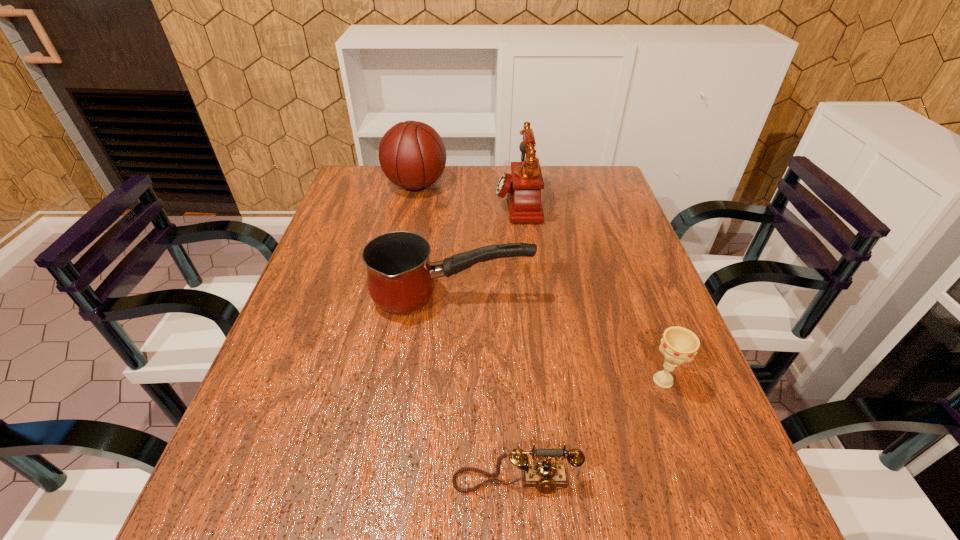
The width and height of the screenshot is (960, 540). Find the location of `free space located on the dial of the taller telephone`. free space located on the dial of the taller telephone is located at coordinates (421, 202).

Find the location of a particular element. blank space located 0.060m on the right of the basketball is located at coordinates (467, 185).

Identify the location of free region located 0.270m on the handle side of the saucepan. (644, 299).

This screenshot has width=960, height=540. What are the coordinates of `blank space located on the back of the rightmost object` in the screenshot? It's located at (625, 276).

This screenshot has height=540, width=960. What are the coordinates of `free region located on the front-facing side of the nearest object` in the screenshot? It's located at (518, 530).

This screenshot has width=960, height=540. What are the coordinates of `telephone that is positioned at the far edge` in the screenshot? It's located at (523, 188).

Find the location of a particular element. basketball that is at the far edge is located at coordinates (412, 155).

The width and height of the screenshot is (960, 540). Find the location of `object that is at the left edge`. object that is at the left edge is located at coordinates (412, 155).

What are the coordinates of `object that is at the right edge` in the screenshot? It's located at (679, 345).

Find the location of a particular element. object situated at the far left corner is located at coordinates (412, 155).